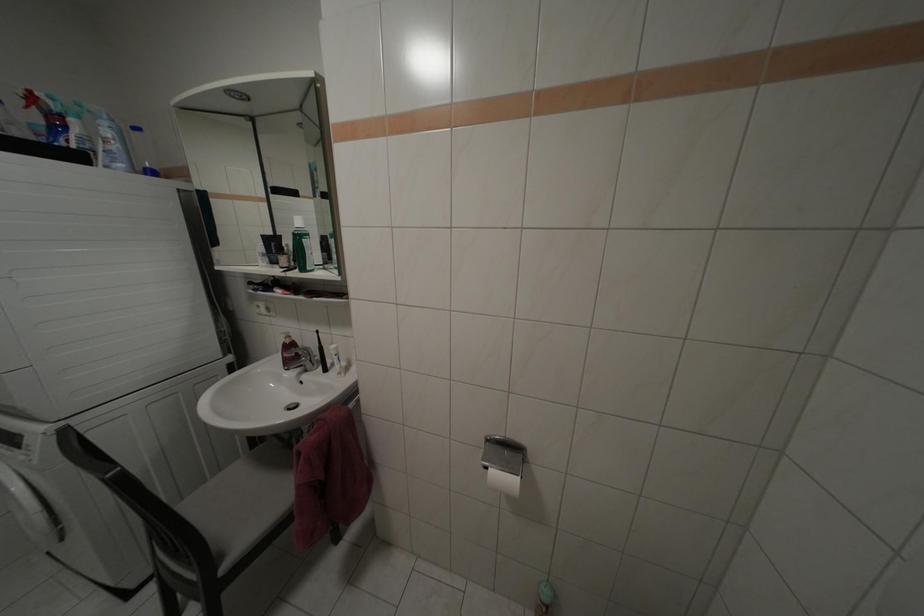
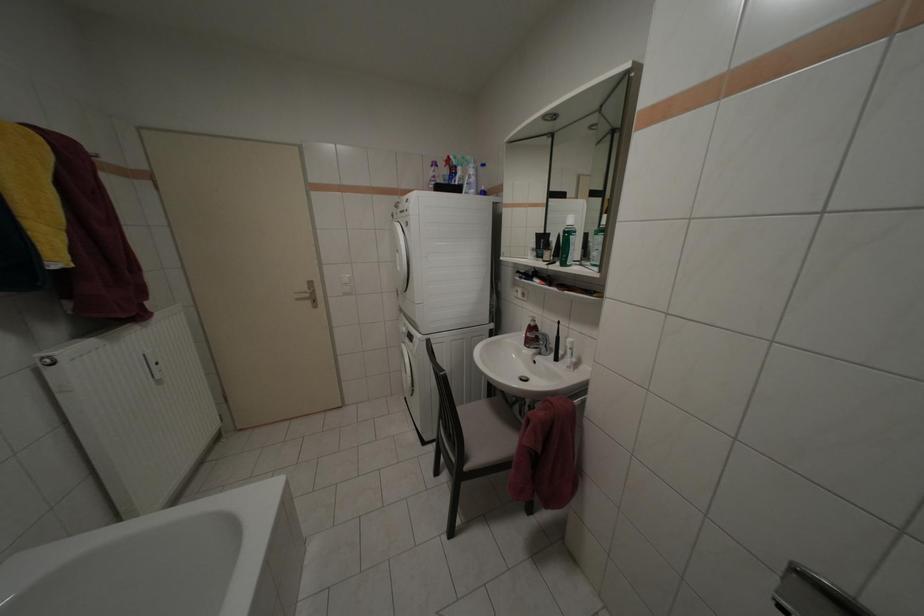
Question: The images are taken continuously from a first-person perspective. In which direction is your viewpoint rotating?

Choices:
 (A) Left
 (B) Right
 (C) Up
 (D) Down

Answer: (A)